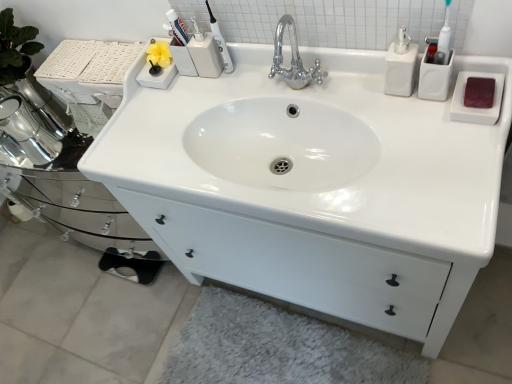
Question: Considering the positions of point (355, 369) and point (232, 69), is point (355, 369) closer or farther from the camera than point (232, 69)?

Choices:
 (A) closer
 (B) farther

Answer: (B)

Question: Visually, is white fluffy bath mat at lower center positioned to the left or to the right of matte plastic toothbrush at upper center?

Choices:
 (A) right
 (B) left

Answer: (A)

Question: Which object is positioned closest to the white fluffy bath mat at lower center?

Choices:
 (A) white glossy sink at center
 (B) matte plastic toothbrush at upper center
 (C) white glossy soap dispenser at upper right

Answer: (A)

Question: Which object is the farthest from the white fluffy bath mat at lower center?

Choices:
 (A) white glossy sink at center
 (B) white glossy soap dispenser at upper right
 (C) matte plastic toothbrush at upper center

Answer: (B)